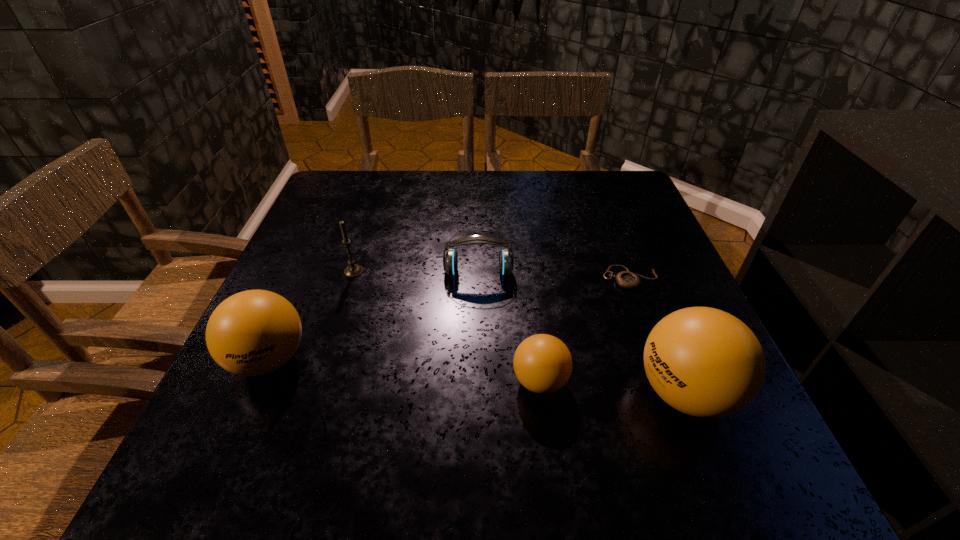
The height and width of the screenshot is (540, 960). I want to click on spot to insert another ping-pong_ball for uniform distribution, so click(401, 370).